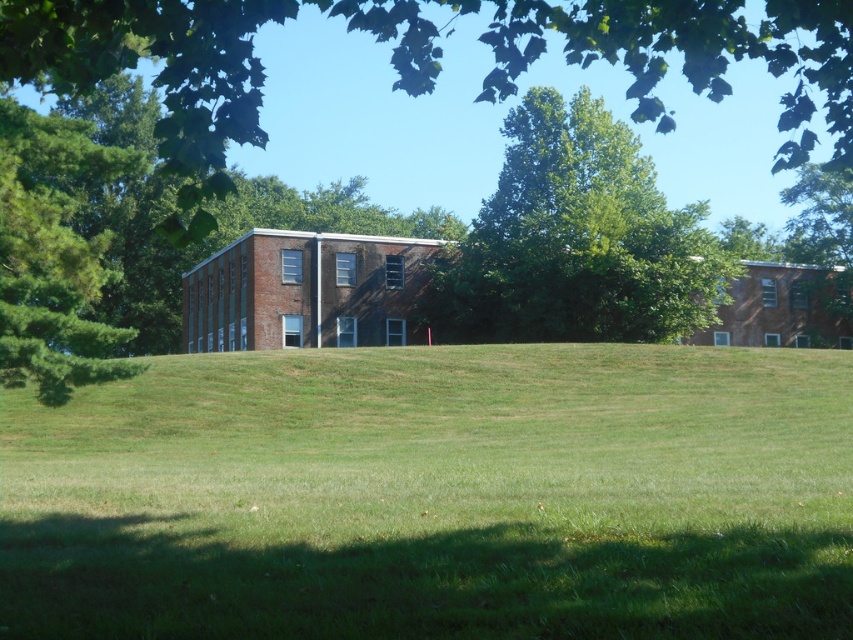
Is point (39, 506) behind point (593, 248)?

No, it is in front of (593, 248).

This screenshot has height=640, width=853. I want to click on green grass at center, so [x=436, y=497].

Between green grass at center and green pine tree at left, which one has less height?

Standing shorter between the two is green grass at center.

Consider the image. Can you confirm if green grass at center is taller than green pine tree at left?

No, green grass at center is not taller than green pine tree at left.

Image resolution: width=853 pixels, height=640 pixels. Describe the element at coordinates (436, 497) in the screenshot. I see `green grass at center` at that location.

You are a GUI agent. You are given a task and a screenshot of the screen. Output one action in this format:
    pyautogui.click(x=<x>, y=<y>)
    Task: Click on the green grass at center
    
    Given the screenshot: What is the action you would take?
    pyautogui.click(x=436, y=497)

Which is in front, point (596, 221) or point (9, 256)?

Point (9, 256)

Which is behind, point (538, 147) or point (90, 298)?

Point (538, 147)

Image resolution: width=853 pixels, height=640 pixels. Find the location of `green leafy tree at center`. green leafy tree at center is located at coordinates (577, 240).